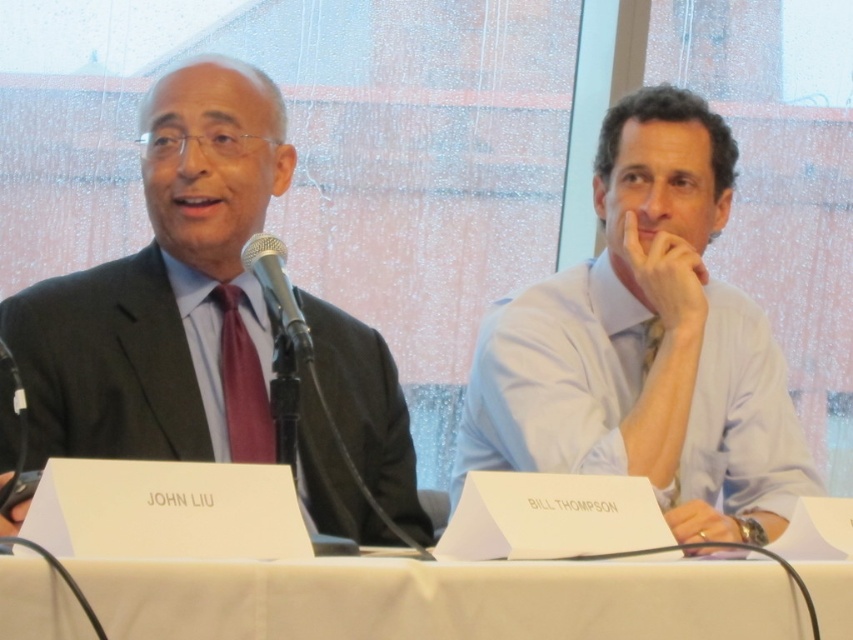
What is located at the point marked by the coordinates (x=444, y=598) in the image?

The point marked by the coordinates (x=444, y=598) is located at the white paper at center.

You are an event planner organizing a panel discussion. You need to place a new speaker between the light blue shirt at right and the metallic silver microphone at center. Based on their current positions, which side of the microphone should you place the new speaker to maintain the existing seating arrangement?

Result: The light blue shirt at right is positioned on the right side of the metallic silver microphone at center. To maintain the existing seating arrangement, the new speaker should be placed to the right of the microphone, next to the light blue shirt at right.

You are an event planner who needs to adjust the table setup for an upcoming presentation. The current setup has the white paper at center and the metallic silver microphone at center. To ensure the microphone is visible to the audience, where should you place the white paper relative to the microphone?

The white paper at center is currently below the metallic silver microphone at center. To make the microphone more visible, you should move the white paper to a position behind or beside the microphone instead of below it.